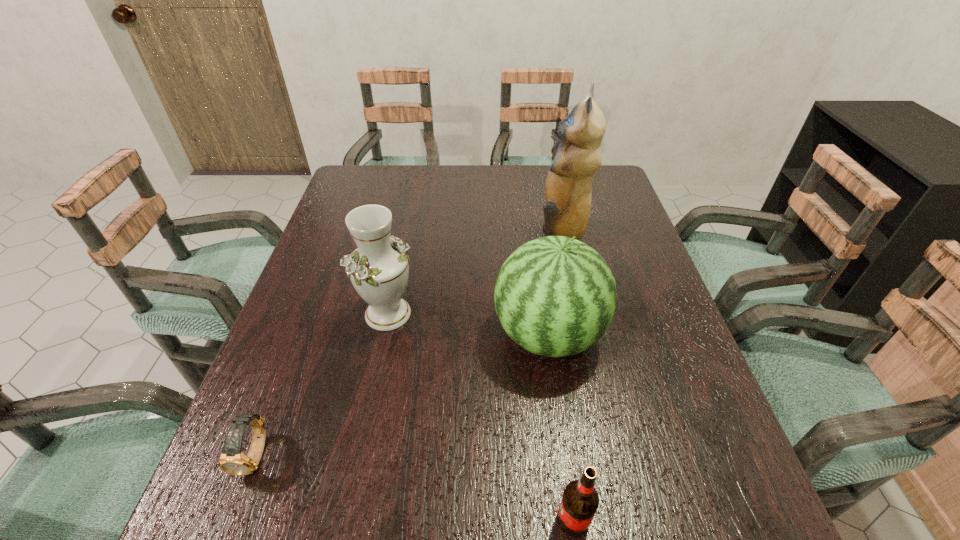
Find the location of `vacant space at the right edge`. vacant space at the right edge is located at coordinates (648, 313).

At what (x,y) coordinates should I click in order to perform the action: click on vacant space at the far left corner of the desktop. Please return your answer as a coordinate pair (x, y). This screenshot has width=960, height=540. Looking at the image, I should click on (353, 168).

This screenshot has height=540, width=960. In order to click on vacant area that lies between the second object from left to right and the root beer in this screenshot , I will do `click(481, 417)`.

Where is `vacant area that lies between the second object from left to right and the tallest object`? vacant area that lies between the second object from left to right and the tallest object is located at coordinates (473, 274).

What are the coordinates of `free space between the farthest object and the watch` in the screenshot? It's located at (408, 345).

The height and width of the screenshot is (540, 960). Identify the location of empty location between the farthest object and the root beer. (566, 377).

At what (x,y) coordinates should I click in order to perform the action: click on empty space that is in between the fourth object from right to left and the root beer. Please return your answer as a coordinate pair (x, y). Looking at the image, I should click on (481, 417).

Identify the location of vacant space that's between the tallest object and the vase. The height and width of the screenshot is (540, 960). (473, 274).

Image resolution: width=960 pixels, height=540 pixels. I want to click on vacant region between the cat and the second object from left to right, so click(473, 274).

Locate an element on the screen. Image resolution: width=960 pixels, height=540 pixels. unoccupied position between the shortest object and the fourth object from right to left is located at coordinates (323, 384).